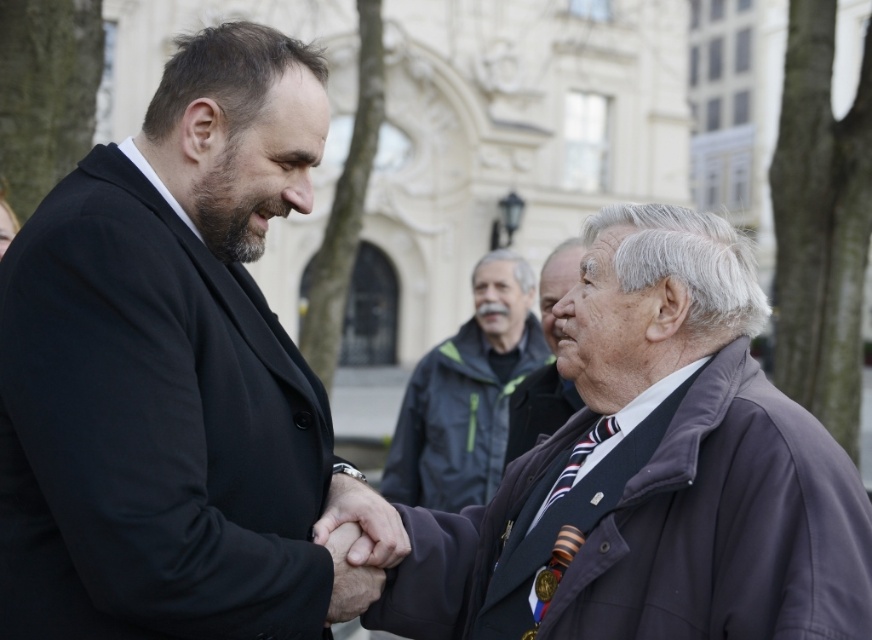
Is smooth skin hand at center to the right of striped fabric tie at center from the viewer's perspective?

In fact, smooth skin hand at center is to the left of striped fabric tie at center.

Is smooth skin hand at center shorter than striped fabric tie at center?

Yes, smooth skin hand at center is shorter than striped fabric tie at center.

Find the location of `smooth skin hand at center`. smooth skin hand at center is located at coordinates (349, 577).

Is point (2, 465) farther from viewer compared to point (461, 420)?

That is False.

Does black matte suit at center have a larger size compared to dark gray jacket at center?

No.

Which is in front, point (65, 596) or point (405, 468)?

Positioned in front is point (65, 596).

Where is `black matte suit at center`? The height and width of the screenshot is (640, 872). black matte suit at center is located at coordinates (168, 369).

Does dark brown leather jacket at right have a larger size compared to smooth skin hand at center?

Yes, dark brown leather jacket at right is bigger than smooth skin hand at center.

Who is more forward, (537, 376) or (332, 577)?

Point (332, 577) is in front.

Locate an element on the screen. The height and width of the screenshot is (640, 872). dark brown leather jacket at right is located at coordinates (537, 408).